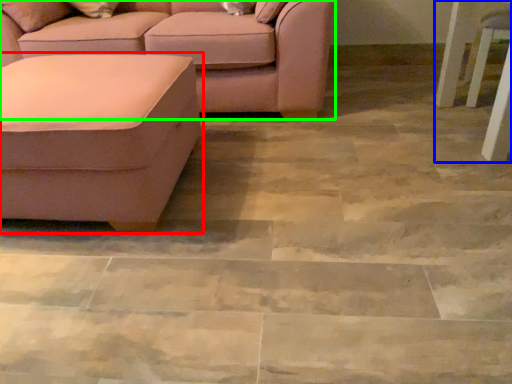
Question: Based on their relative distances, which object is farther from studio couch (highlighted by a red box)? Choose from side table (highlighted by a blue box) and studio couch (highlighted by a green box).

Choices:
 (A) side table
 (B) studio couch

Answer: (A)